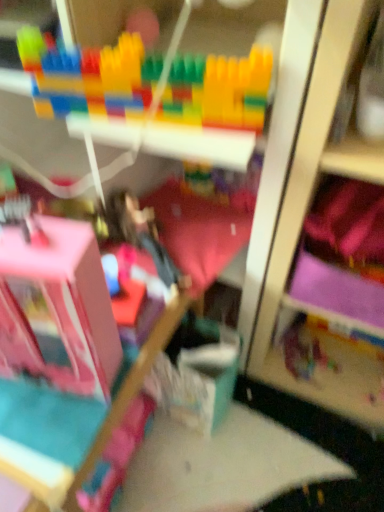
What do you see at coordinates (304, 352) in the screenshot? The width and height of the screenshot is (384, 512). I see `translucent plastic toy at center, which is the first toy from right to left` at bounding box center [304, 352].

The image size is (384, 512). Describe the element at coordinates (131, 388) in the screenshot. I see `pink fabric bed frame at lower left` at that location.

Where is `pink fabric bedding at center`? This screenshot has width=384, height=512. pink fabric bedding at center is located at coordinates (198, 231).

Where is `multicolored plastic blocks at upper center, which ranks as the 1th toy in top-to-bottom order`? multicolored plastic blocks at upper center, which ranks as the 1th toy in top-to-bottom order is located at coordinates (89, 76).

Find the location of a particular element. Image resolution: width=384 pixels, height=512 pixels. translucent plastic toy at center, the 3th toy when ordered from front to back is located at coordinates (304, 352).

Identify the location of toy that is the 1st one above the pink fabric bedding at center (from a real-world perspective). This screenshot has height=512, width=384. (60, 308).

What's the angular difference between pink plastic dollhouse at lower left, the third toy when ordered from back to front, and pink fabric bedding at center's facing directions?

There is a 26.9-degree angle between the facing directions of pink plastic dollhouse at lower left, the third toy when ordered from back to front, and pink fabric bedding at center.

Is point (16, 274) closer or farther from the camera than point (167, 239)?

Point (16, 274).

Considering the relative sizes of translucent plastic toy at center, arranged as the 1th toy when ordered from the bottom, and pink fabric bedding at center in the image provided, is translucent plastic toy at center, arranged as the 1th toy when ordered from the bottom, smaller than pink fabric bedding at center?

Correct, translucent plastic toy at center, arranged as the 1th toy when ordered from the bottom, occupies less space than pink fabric bedding at center.

Is translucent plastic toy at center, the 3th toy when ordered from front to back, far away from pink fabric bedding at center?

translucent plastic toy at center, the 3th toy when ordered from front to back, is near pink fabric bedding at center, not far away.

Measure the distance between translucent plastic toy at center, the third toy from the left, and pink fabric bedding at center.

translucent plastic toy at center, the third toy from the left, is 17.81 inches away from pink fabric bedding at center.

From the image's perspective, is translucent plastic toy at center, arranged as the 1th toy when ordered from the bottom, above or below pink fabric bedding at center?

From the image's perspective, translucent plastic toy at center, arranged as the 1th toy when ordered from the bottom, appears below pink fabric bedding at center.

From a real-world perspective, who is located higher, pink fabric bed frame at lower left or multicolored plastic blocks at upper center, which is the second toy in back-to-front order?

From a 3D spatial view, multicolored plastic blocks at upper center, which is the second toy in back-to-front order, is above.

Considering the positions of objects pink fabric bed frame at lower left and multicolored plastic blocks at upper center, positioned as the 2th toy in front-to-back order, in the image provided, who is more to the left, pink fabric bed frame at lower left or multicolored plastic blocks at upper center, positioned as the 2th toy in front-to-back order,?

pink fabric bed frame at lower left is more to the left.

Relative to pink plastic dollhouse at lower left, the 2th toy when ordered from bottom to top, is multicolored plastic blocks at upper center, which is the second toy in back-to-front order, in front or behind?

In the image, multicolored plastic blocks at upper center, which is the second toy in back-to-front order, appears behind pink plastic dollhouse at lower left, the 2th toy when ordered from bottom to top.

From the image's perspective, is multicolored plastic blocks at upper center, which is counted as the third toy, starting from the bottom, above or below pink plastic dollhouse at lower left, the 2th toy when ordered from bottom to top?

Based on their image positions, multicolored plastic blocks at upper center, which is counted as the third toy, starting from the bottom, is located above pink plastic dollhouse at lower left, the 2th toy when ordered from bottom to top.

Is multicolored plastic blocks at upper center, which is the second toy in right-to-left order, not inside pink plastic dollhouse at lower left, placed as the 2th toy when sorted from top to bottom?

Yes, multicolored plastic blocks at upper center, which is the second toy in right-to-left order, is outside of pink plastic dollhouse at lower left, placed as the 2th toy when sorted from top to bottom.

From a real-world perspective, does multicolored plastic blocks at upper center, which ranks as the 1th toy in top-to-bottom order, sit lower than pink plastic dollhouse at lower left, the third toy viewed from the right?

Actually, multicolored plastic blocks at upper center, which ranks as the 1th toy in top-to-bottom order, is physically above pink plastic dollhouse at lower left, the third toy viewed from the right, in the real world.

Considering the positions of objects pink fabric bedding at center and pink fabric bed frame at lower left in the image provided, who is behind, pink fabric bedding at center or pink fabric bed frame at lower left?

pink fabric bedding at center.

Is pink fabric bedding at center with pink fabric bed frame at lower left?

No, pink fabric bedding at center is not beside pink fabric bed frame at lower left.

Which of these two, pink fabric bedding at center or pink fabric bed frame at lower left, is smaller?

Smaller between the two is pink fabric bedding at center.

Is pink plastic dollhouse at lower left, the 1th toy positioned from the front, positioned far away from pink fabric bed frame at lower left?

No, pink plastic dollhouse at lower left, the 1th toy positioned from the front, is not far away from pink fabric bed frame at lower left.

Consider the image. Does pink plastic dollhouse at lower left, placed as the 2th toy when sorted from top to bottom, have a greater height compared to pink fabric bed frame at lower left?

No.

Is pink plastic dollhouse at lower left, placed as the 2th toy when sorted from top to bottom, oriented towards pink fabric bed frame at lower left?

No, pink plastic dollhouse at lower left, placed as the 2th toy when sorted from top to bottom, is not aimed at pink fabric bed frame at lower left.

Based on their sizes in the image, would you say pink plastic dollhouse at lower left, the 1th toy positioned from the front, is bigger or smaller than pink fabric bed frame at lower left?

Considering their sizes, pink plastic dollhouse at lower left, the 1th toy positioned from the front, takes up less space than pink fabric bed frame at lower left.

In terms of height, does translucent plastic toy at center, acting as the 3th toy starting from the top, look taller or shorter compared to pink plastic dollhouse at lower left, which is counted as the first toy, starting from the left?

In the image, translucent plastic toy at center, acting as the 3th toy starting from the top, appears to be shorter than pink plastic dollhouse at lower left, which is counted as the first toy, starting from the left.

Which object is further away from the camera taking this photo, translucent plastic toy at center, arranged as the 1th toy when ordered from the bottom, or pink plastic dollhouse at lower left, the third toy viewed from the right?

Positioned behind is translucent plastic toy at center, arranged as the 1th toy when ordered from the bottom.

Where is `toy below the pink plastic dollhouse at lower left, the 1th toy positioned from the front (from a real-world perspective)`? toy below the pink plastic dollhouse at lower left, the 1th toy positioned from the front (from a real-world perspective) is located at coordinates (304, 352).

Between translucent plastic toy at center, arranged as the 1th toy when ordered from the bottom, and pink plastic dollhouse at lower left, placed as the 2th toy when sorted from top to bottom, which one has larger size?

Bigger between the two is pink plastic dollhouse at lower left, placed as the 2th toy when sorted from top to bottom.

You are a GUI agent. You are given a task and a screenshot of the screen. Output one action in this format:
    pyautogui.click(x=<x>, y=<y>)
    Task: Click on the toy that is the 1st object located below the pink fabric bedding at center (from the image's perspective)
    
    Given the screenshot: What is the action you would take?
    pyautogui.click(x=60, y=308)

I want to click on toy on the right of pink fabric bedding at center, so click(304, 352).

Estimate the real-world distances between objects in this image. Which object is further from translucent plastic toy at center, the 3th toy when ordered from front to back, multicolored plastic blocks at upper center, positioned as the 2th toy in front-to-back order, or pink plastic dollhouse at lower left, placed as the 2th toy when sorted from top to bottom?

multicolored plastic blocks at upper center, positioned as the 2th toy in front-to-back order, is positioned further to the anchor translucent plastic toy at center, the 3th toy when ordered from front to back.

From the image, which object appears to be nearer to pink fabric bed frame at lower left, pink plastic dollhouse at lower left, the 1th toy positioned from the front, or translucent plastic toy at center, the 1th toy when ordered from back to front?

pink plastic dollhouse at lower left, the 1th toy positioned from the front, is positioned closer to the anchor pink fabric bed frame at lower left.

When comparing their distances from pink fabric bed frame at lower left, does multicolored plastic blocks at upper center, which is counted as the third toy, starting from the bottom, or pink fabric bedding at center seem closer?

Among the two, pink fabric bedding at center is located nearer to pink fabric bed frame at lower left.

When comparing their distances from pink fabric bed frame at lower left, does pink fabric bedding at center or translucent plastic toy at center, acting as the 3th toy starting from the top, seem further?

translucent plastic toy at center, acting as the 3th toy starting from the top, is further to pink fabric bed frame at lower left.

Based on their spatial positions, is pink fabric bed frame at lower left or multicolored plastic blocks at upper center, which is the second toy in right-to-left order, closer to translucent plastic toy at center, the third toy from the left?

pink fabric bed frame at lower left.

Looking at the image, which one is located closer to pink fabric bed frame at lower left, translucent plastic toy at center, acting as the 3th toy starting from the top, or pink plastic dollhouse at lower left, placed as the 2th toy when sorted from top to bottom?

Based on the image, pink plastic dollhouse at lower left, placed as the 2th toy when sorted from top to bottom, appears to be nearer to pink fabric bed frame at lower left.

Estimate the real-world distances between objects in this image. Which object is closer to multicolored plastic blocks at upper center, positioned as the 2th toy in front-to-back order, pink plastic dollhouse at lower left, the third toy when ordered from back to front, or pink fabric bed frame at lower left?

Based on the image, pink plastic dollhouse at lower left, the third toy when ordered from back to front, appears to be nearer to multicolored plastic blocks at upper center, positioned as the 2th toy in front-to-back order.

When comparing their distances from pink plastic dollhouse at lower left, which is counted as the first toy, starting from the left, does pink fabric bedding at center or pink fabric bed frame at lower left seem closer?

pink fabric bed frame at lower left is positioned closer to the anchor pink plastic dollhouse at lower left, which is counted as the first toy, starting from the left.

This screenshot has height=512, width=384. In order to click on toy between pink plastic dollhouse at lower left, the 1th toy positioned from the front, and translucent plastic toy at center, the 1th toy when ordered from back to front, along the z-axis in this screenshot , I will do `click(89, 76)`.

Identify the location of bedding between multicolored plastic blocks at upper center, which is the second toy in back-to-front order, and translucent plastic toy at center, the 1th toy when ordered from back to front, vertically. (198, 231).

Find the location of `bed frame between pink plastic dollhouse at lower left, the third toy when ordered from back to front, and pink fabric bedding at center in the front-back direction`. bed frame between pink plastic dollhouse at lower left, the third toy when ordered from back to front, and pink fabric bedding at center in the front-back direction is located at coordinates tap(131, 388).

Locate an element on the screen. This screenshot has height=512, width=384. bedding between pink fabric bed frame at lower left and translucent plastic toy at center, the third toy from the left, from left to right is located at coordinates (198, 231).